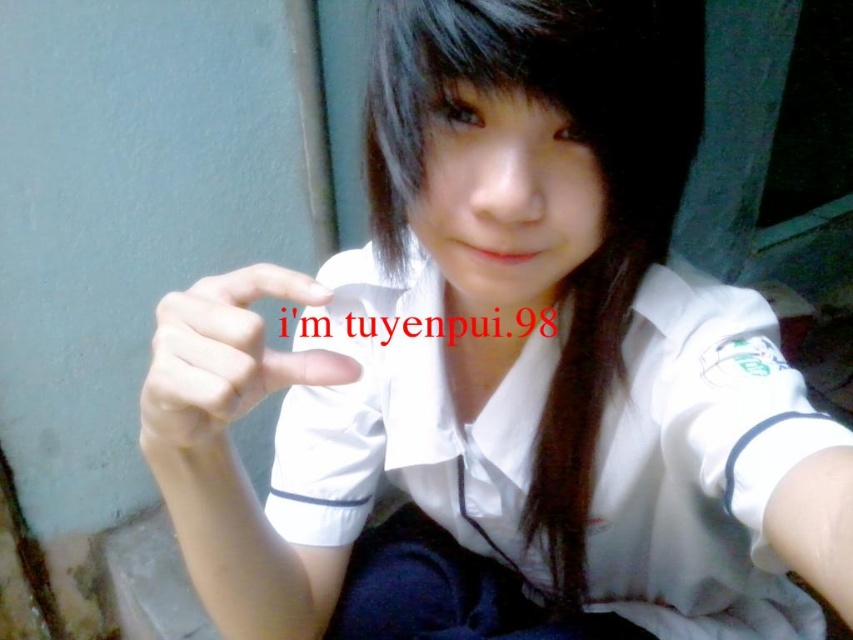
Who is taller, black silky hair at center or white matte hand at center?

Standing taller between the two is black silky hair at center.

Does black silky hair at center lie behind white matte hand at center?

Yes, it is behind white matte hand at center.

Which is behind, point (682, 72) or point (244, 326)?

Positioned behind is point (682, 72).

This screenshot has height=640, width=853. I want to click on black silky hair at center, so click(x=599, y=179).